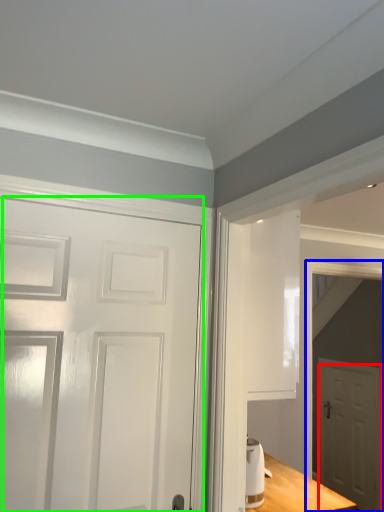
Question: Based on their relative distances, which object is farther from door (highlighted by a red box)? Choose from elevator (highlighted by a blue box) and door (highlighted by a green box).

Choices:
 (A) elevator
 (B) door

Answer: (B)